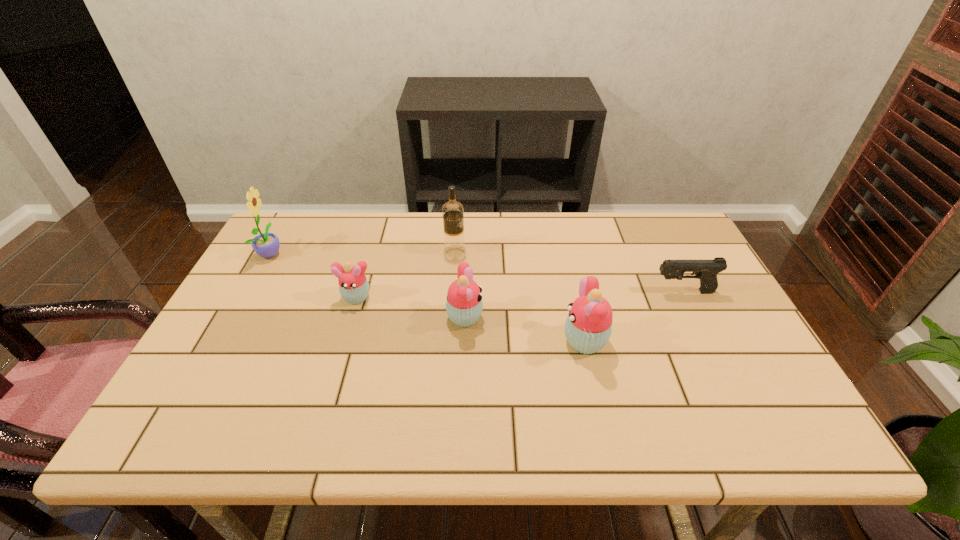
At what (x,y) coordinates should I click in order to perform the action: click on the leftmost cupcake. Please return your answer as a coordinate pair (x, y). Looking at the image, I should click on (x=353, y=286).

Image resolution: width=960 pixels, height=540 pixels. Identify the location of the second object from left to right. 353,286.

Locate an element on the screen. This screenshot has height=540, width=960. the second tallest cupcake is located at coordinates (464, 305).

In order to click on the second cupcake from right to left in this screenshot , I will do `click(464, 305)`.

This screenshot has height=540, width=960. Identify the location of the fifth object from left to right. (588, 327).

Find the location of `vodka`. vodka is located at coordinates (454, 245).

Locate an element on the screen. The height and width of the screenshot is (540, 960). sunflower is located at coordinates (266, 245).

Locate an element on the screen. This screenshot has height=540, width=960. pistol is located at coordinates 706,270.

This screenshot has height=540, width=960. I want to click on vacant space located on the face of the shortest cupcake, so 347,330.

Locate an element on the screen. The height and width of the screenshot is (540, 960). vacant space positioned on the face of the third shortest object is located at coordinates (598, 318).